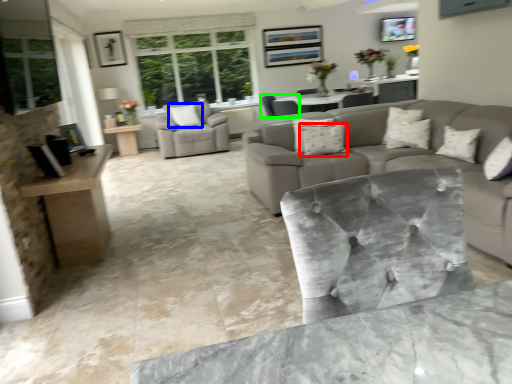
Question: Which object is positioned closest to pillow (highlighted by a red box)? Select from pillow (highlighted by a blue box) and chair (highlighted by a green box).

Choices:
 (A) pillow
 (B) chair

Answer: (B)